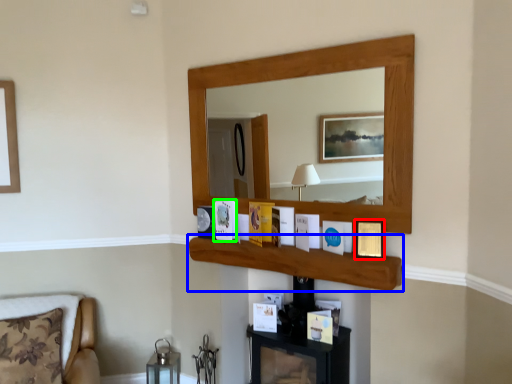
Question: Which object is the closest to the picture frame (highlighted by a red box)? Choose among these: cabinet (highlighted by a blue box) or picture frame (highlighted by a green box).

Choices:
 (A) cabinet
 (B) picture frame

Answer: (A)